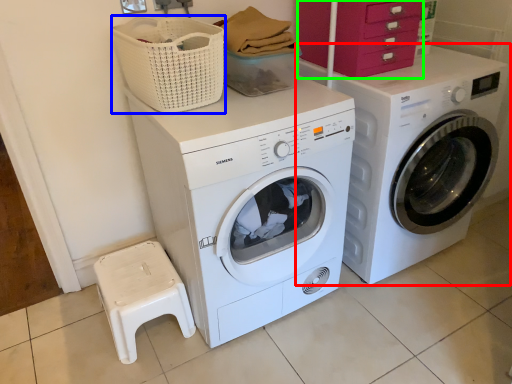
Question: Which object is the closest to the washing machine (highlighted by a red box)? Choose among these: basket (highlighted by a blue box) or drawer (highlighted by a green box).

Choices:
 (A) basket
 (B) drawer

Answer: (B)